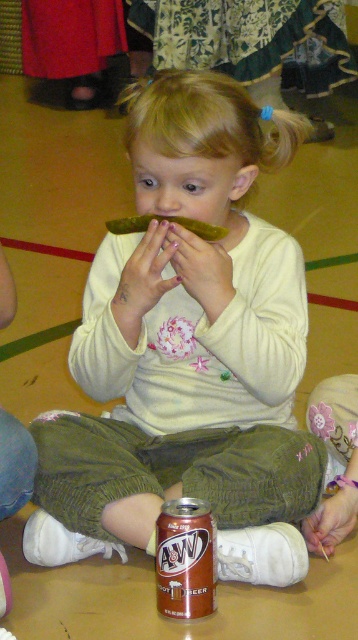
The child is holding a green pickled cucumber at center and has a brown matte can at center nearby. Which object is positioned lower from the child?

The brown matte can at center is positioned lower than the green pickled cucumber at center.

The pale skin at center is 4.51 feet away from the can of A W Root Beer placed on the floor. If the child wants to grab the can without moving their body, can they reach it?

The pale skin at center is 4.51 feet away from the can of A W Root Beer placed on the floor. Since the average arm length for a child of this age is around 2 feet, the child cannot reach the can without moving their body.

You are a delivery robot with a 1 meter wide base. You need to move from the entrance to the brown matte can at center while avoiding the green pickled cucumber at center. Is there enough space between them for your path?

The distance between the brown matte can at center and the green pickled cucumber at center is 76.92 centimeters. Since your base is 1 meter wide, the space between them is insufficient for your path as 76.92 cm is less than 1 meter.